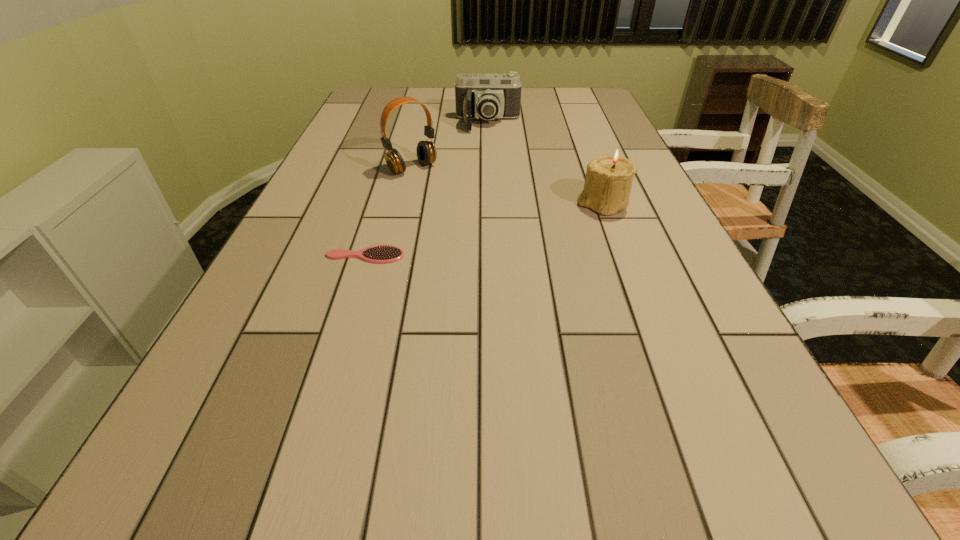
Where is `free space at the right edge of the desktop`? free space at the right edge of the desktop is located at coordinates (656, 214).

This screenshot has width=960, height=540. In the image, there is a desktop. Identify the location of vacant space at the far left corner. (397, 93).

This screenshot has height=540, width=960. I want to click on free space at the far right corner of the desktop, so click(x=588, y=96).

Where is `free area in between the camera and the second farthest object`? The width and height of the screenshot is (960, 540). free area in between the camera and the second farthest object is located at coordinates (450, 146).

This screenshot has width=960, height=540. Find the location of `unoccupied position between the shortest object and the second object from right to left`. unoccupied position between the shortest object and the second object from right to left is located at coordinates (426, 190).

This screenshot has width=960, height=540. I want to click on vacant point located between the nearest object and the farthest object, so click(426, 190).

The image size is (960, 540). In order to click on free space between the headset and the third object from left to right in this screenshot , I will do `click(450, 146)`.

What are the coordinates of `vacant space that is in between the third nearest object and the third farthest object` in the screenshot? It's located at (508, 186).

The height and width of the screenshot is (540, 960). Find the location of `empty location between the candle_holder and the second farthest object`. empty location between the candle_holder and the second farthest object is located at coordinates (508, 186).

Where is `free space between the shortest object and the rightmost object`? free space between the shortest object and the rightmost object is located at coordinates (484, 230).